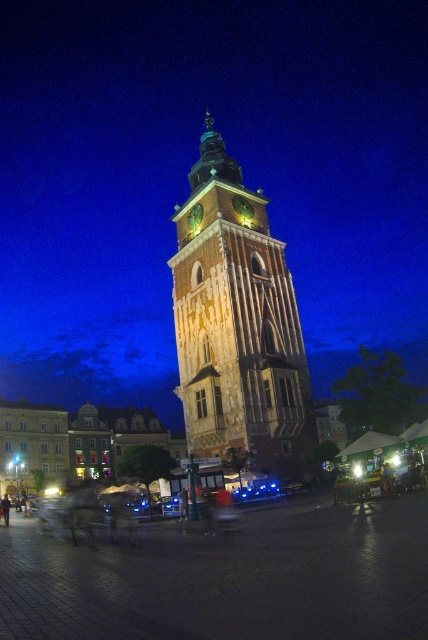
Can you confirm if stone clock tower at center is bigger than gold textured clock at center?

Indeed, stone clock tower at center has a larger size compared to gold textured clock at center.

Between point (175, 342) and point (250, 209), which one is positioned in front?

Point (250, 209) is more forward.

You are a GUI agent. You are given a task and a screenshot of the screen. Output one action in this format:
    pyautogui.click(x=<x>, y=<y>)
    Task: Click on the stone clock tower at center
    The height and width of the screenshot is (640, 428).
    Given the screenshot: What is the action you would take?
    pyautogui.click(x=237, y=326)

Who is more distant from viewer, (250, 214) or (199, 227)?

The point (250, 214) is behind.

Can you confirm if gold textured clock at center is positioned above green stone clock at center?

Yes, gold textured clock at center is above green stone clock at center.

Locate an element on the screen. The height and width of the screenshot is (640, 428). gold textured clock at center is located at coordinates (243, 208).

Who is shorter, stone clock tower at center or green stone clock at center?

green stone clock at center

Does stone clock tower at center appear under green stone clock at center?

No.

Which is in front, point (184, 307) or point (192, 230)?

Point (184, 307)

Where is `stone clock tower at center`? This screenshot has height=640, width=428. stone clock tower at center is located at coordinates (237, 326).